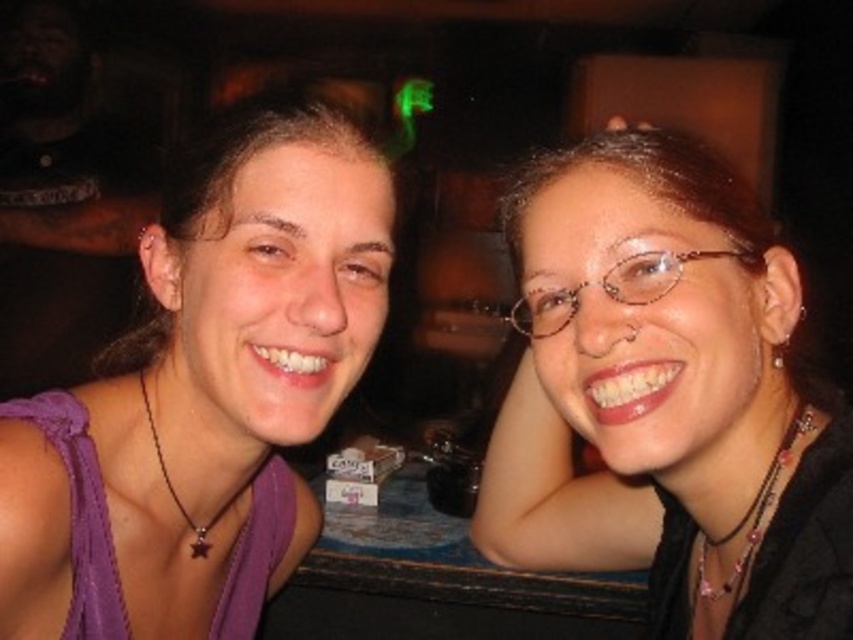
Question: Is purple fabric top at left to the right of clear plastic glasses at upper right from the viewer's perspective?

Choices:
 (A) no
 (B) yes

Answer: (A)

Question: Estimate the real-world distances between objects in this image. Which object is closer to the clear plastic glasses at upper right?

Choices:
 (A) matte black glasses at center
 (B) purple fabric top at left

Answer: (A)

Question: Is matte black glasses at center above clear plastic glasses at upper right?

Choices:
 (A) yes
 (B) no

Answer: (B)

Question: Which of the following is the closest to the observer?

Choices:
 (A) (660, 298)
 (B) (627, 392)

Answer: (A)

Question: Estimate the real-world distances between objects in this image. Which object is closer to the matte black glasses at center?

Choices:
 (A) purple fabric top at left
 (B) clear plastic glasses at upper right

Answer: (B)

Question: Does purple fabric top at left appear on the left side of clear plastic glasses at upper right?

Choices:
 (A) no
 (B) yes

Answer: (B)